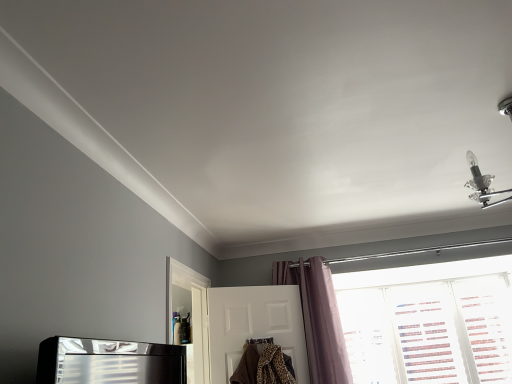
Question: From the image's perspective, is transparent plastic screen door at lower left located beneath purple velvet curtain at center?

Choices:
 (A) no
 (B) yes

Answer: (A)

Question: Could you tell me if transparent plastic screen door at lower left is facing purple velvet curtain at center?

Choices:
 (A) no
 (B) yes

Answer: (B)

Question: Can you confirm if transparent plastic screen door at lower left is smaller than purple velvet curtain at center?

Choices:
 (A) no
 (B) yes

Answer: (B)

Question: Are transparent plastic screen door at lower left and purple velvet curtain at center located far from each other?

Choices:
 (A) no
 (B) yes

Answer: (A)

Question: Is purple velvet curtain at center completely or partially inside transparent plastic screen door at lower left?

Choices:
 (A) yes
 (B) no

Answer: (B)

Question: Considering the relative positions of transparent plastic screen door at lower left and purple velvet curtain at center in the image provided, is transparent plastic screen door at lower left to the left of purple velvet curtain at center from the viewer's perspective?

Choices:
 (A) no
 (B) yes

Answer: (B)

Question: Is the position of white matte door at center more distant than that of transparent plastic screen door at lower left?

Choices:
 (A) no
 (B) yes

Answer: (B)

Question: Can you confirm if white matte door at center is taller than transparent plastic screen door at lower left?

Choices:
 (A) yes
 (B) no

Answer: (B)

Question: From the image's perspective, is white matte door at center under transparent plastic screen door at lower left?

Choices:
 (A) no
 (B) yes

Answer: (B)

Question: Is white matte door at center outside transparent plastic screen door at lower left?

Choices:
 (A) no
 (B) yes

Answer: (B)

Question: From a real-world perspective, does white matte door at center stand above transparent plastic screen door at lower left?

Choices:
 (A) yes
 (B) no

Answer: (B)

Question: Is white matte door at center closer to the viewer compared to transparent plastic screen door at lower left?

Choices:
 (A) no
 (B) yes

Answer: (A)

Question: Does purple velvet curtain at center have a lesser height compared to transparent plastic screen door at lower left?

Choices:
 (A) no
 (B) yes

Answer: (A)